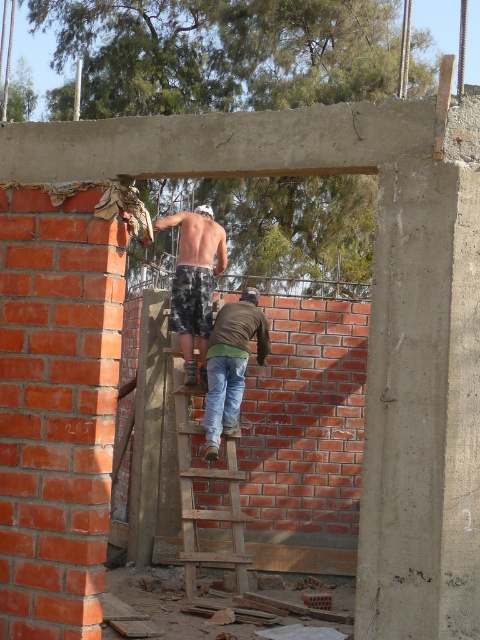
Question: Which object is the farthest from the jeans at center?

Choices:
 (A) camo shorts at center
 (B) wooden at center

Answer: (B)

Question: Which object is closer to the camera taking this photo?

Choices:
 (A) jeans at center
 (B) wooden at center
 (C) camo shorts at center

Answer: (B)

Question: Can you confirm if wooden at center is smaller than camo shorts at center?

Choices:
 (A) no
 (B) yes

Answer: (A)

Question: Does camo shorts at center have a larger size compared to jeans at center?

Choices:
 (A) no
 (B) yes

Answer: (B)

Question: Which point is closer to the camera?

Choices:
 (A) (232, 536)
 (B) (178, 276)
 (C) (228, 310)

Answer: (A)

Question: Is camo shorts at center further to the viewer compared to jeans at center?

Choices:
 (A) no
 (B) yes

Answer: (B)